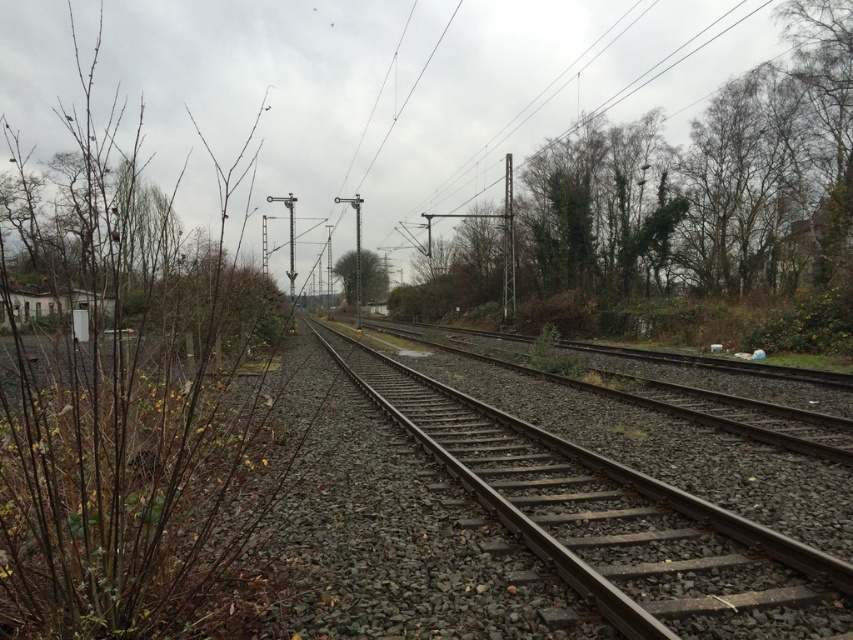
Is green leafy shrub at right thinner than metal train track at center?

Incorrect, green leafy shrub at right's width is not less than metal train track at center's.

Can you confirm if green leafy shrub at right is smaller than metal train track at center?

Actually, green leafy shrub at right might be larger than metal train track at center.

Between point (718, 202) and point (639, 547), which one is positioned behind?

Point (718, 202)

At what (x,y) coordinates should I click in order to perform the action: click on green leafy shrub at right. Please return your answer as a coordinate pair (x, y). Looking at the image, I should click on (688, 195).

How distant is brown woody branches at left from green leafy shrub at right?

A distance of 31.12 meters exists between brown woody branches at left and green leafy shrub at right.

Is brown woody branches at left positioned at the back of green leafy shrub at right?

No, it is not.

Find the location of a particular element. This screenshot has height=640, width=853. brown woody branches at left is located at coordinates (125, 390).

Can you confirm if green leafy shrub at right is smaller than green leafy tree at center?

Actually, green leafy shrub at right might be larger than green leafy tree at center.

Which is in front, point (757, 259) or point (378, 285)?

Point (757, 259) is in front.

Find the location of a particular element. green leafy shrub at right is located at coordinates pos(688,195).

Where is `green leafy shrub at right`? This screenshot has height=640, width=853. green leafy shrub at right is located at coordinates (688, 195).